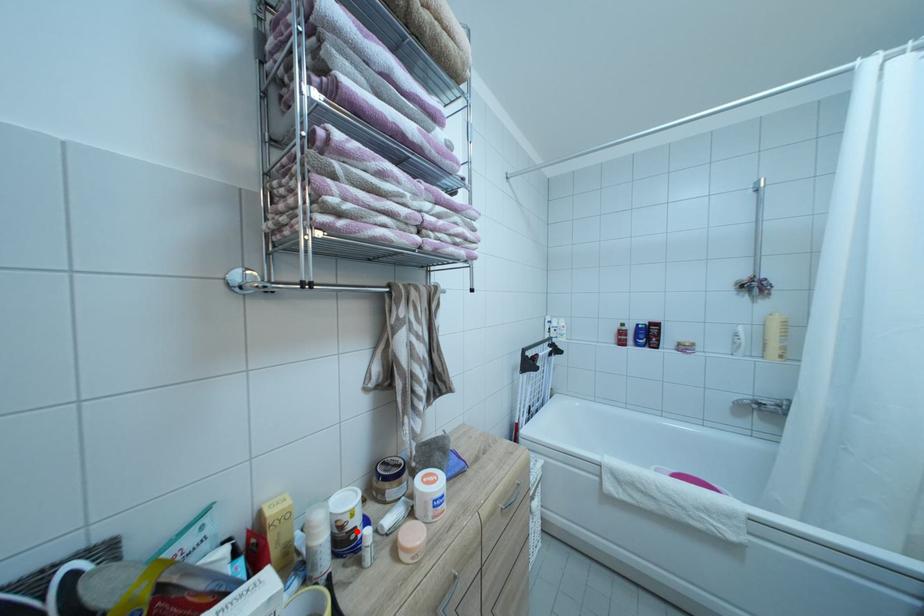
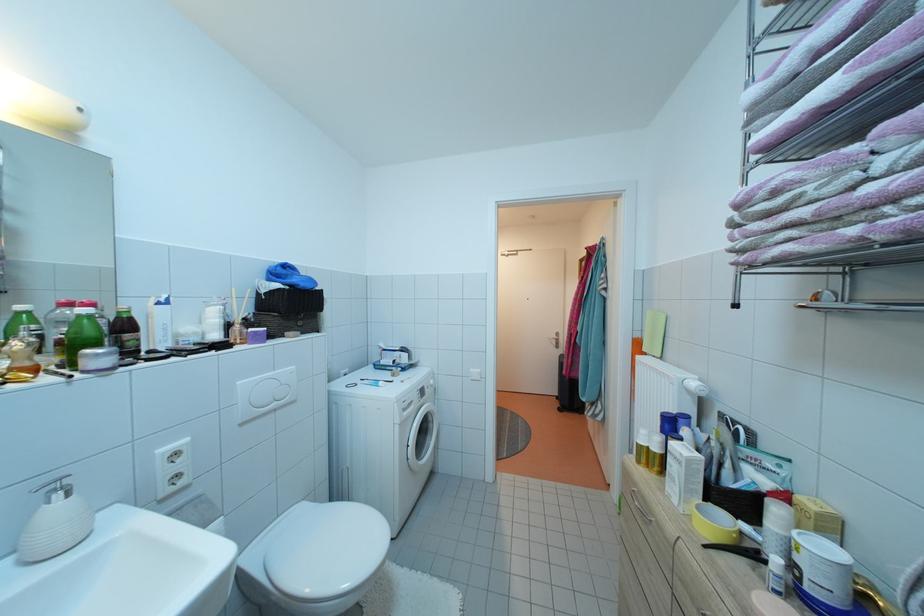
Locate, in the second image, the point that corresponds to the highlighted location in the first image.

(805, 565)